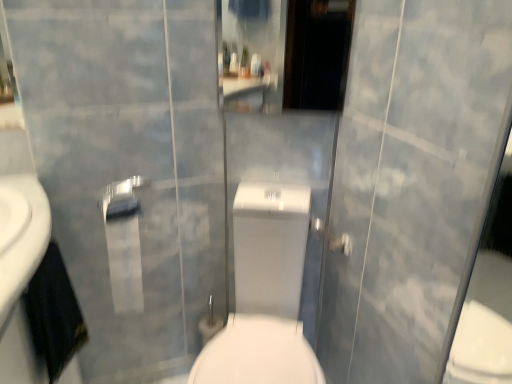
Question: From the image's perspective, is silver metallic towel bar at upper center located above or below white glossy toilet at center?

Choices:
 (A) above
 (B) below

Answer: (A)

Question: Relative to white glossy toilet at center, is silver metallic towel bar at upper center in front or behind?

Choices:
 (A) front
 (B) behind

Answer: (B)

Question: Which object is positioned closest to the white glossy toilet at center?

Choices:
 (A) silver metallic towel bar at upper center
 (B) matte silver shower at center

Answer: (B)

Question: Which object is positioned farthest from the white glossy toilet at center?

Choices:
 (A) silver metallic towel bar at upper center
 (B) matte silver shower at center

Answer: (A)